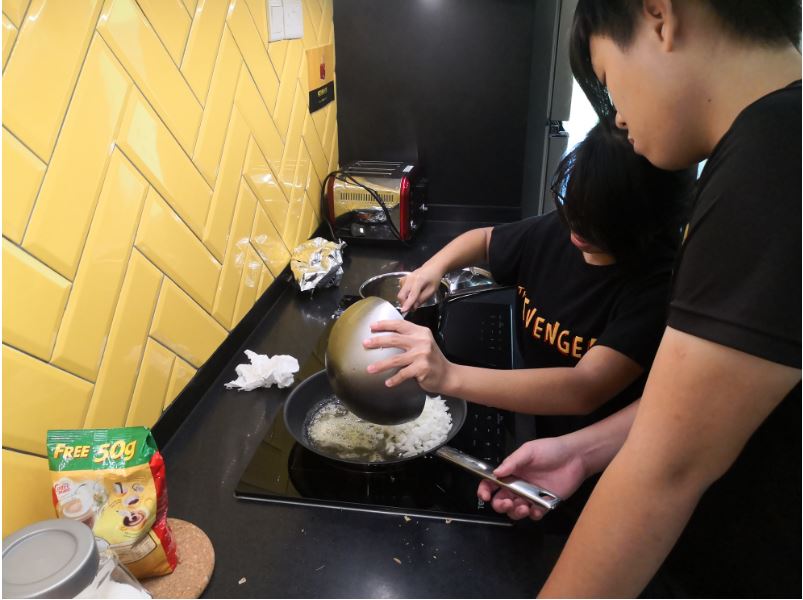
Identify the location of handle. The width and height of the screenshot is (803, 600). (479, 464).